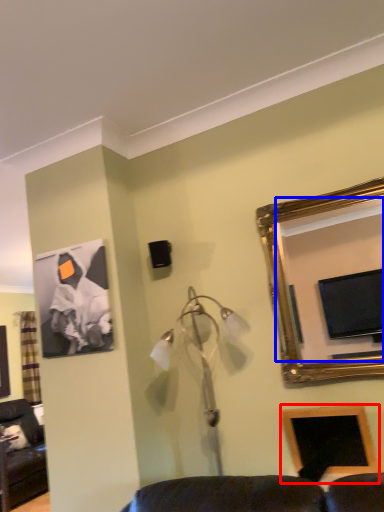
Question: Among these objects, which one is nearest to the camera, picture frame (highlighted by a red box) or mirror (highlighted by a blue box)?

Choices:
 (A) picture frame
 (B) mirror

Answer: (B)